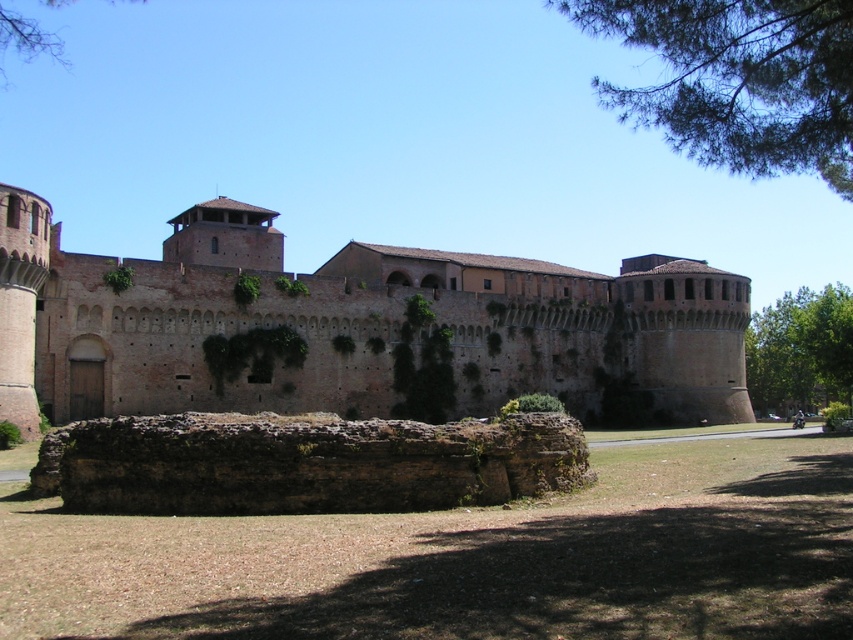
Based on the photo, you are standing at the entrance of the fortress and see two points marked on the wall. The first point is at coordinate point (601, 83) and the second is at point (844, 401). If you were to walk towards the fortress wall, which point would you encounter first?

Point (844, 401) would be encountered first because it is in front of point (601, 83) according to the spatial description.

You are a bird flying over the fortress. You want to land on the highest point between the brown brick wall at center and the green leafy tree at upper left. Which one should you choose?

The green leafy tree at upper left is taller than the brown brick wall at center, so you should choose the green leafy tree at upper left to land on the highest point.